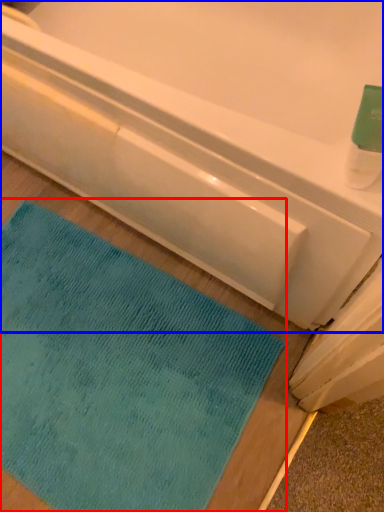
Question: Among these objects, which one is nearest to the camera, mat (highlighted by a red box) or bathtub (highlighted by a blue box)?

Choices:
 (A) mat
 (B) bathtub

Answer: (B)